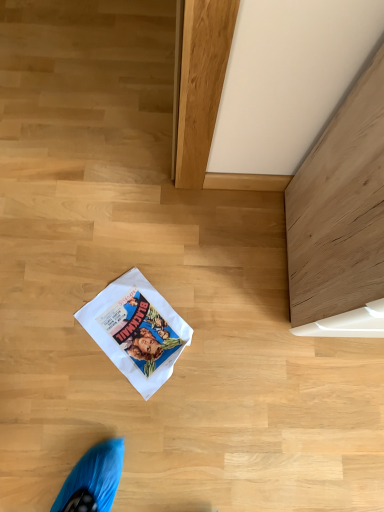
Identify the location of blank space situated above white paper comic book at center (from a real-world perspective). (138, 329).